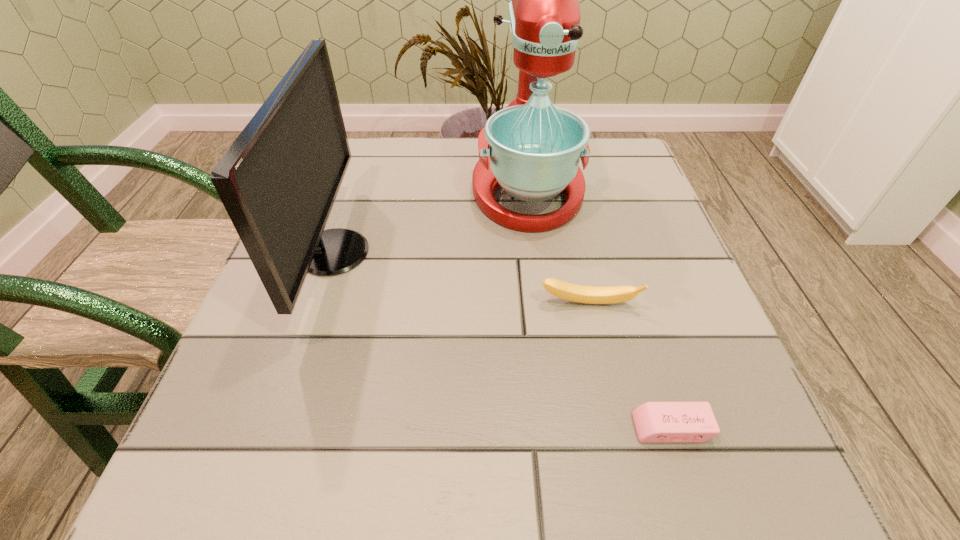
The image size is (960, 540). What are the coordinates of `vacant area at the near edge of the desktop` in the screenshot? It's located at (415, 472).

Where is `free space at the left edge of the desktop`? The width and height of the screenshot is (960, 540). free space at the left edge of the desktop is located at coordinates (374, 194).

The image size is (960, 540). What are the coordinates of `blank space at the right edge of the desktop` in the screenshot? It's located at (600, 271).

What are the coordinates of `free space at the far left corner of the desktop` in the screenshot? It's located at 371,145.

In the image, there is a desktop. Where is `free space at the far right corner`? free space at the far right corner is located at coordinates (603, 162).

I want to click on vacant space that's between the banana and the mixer, so click(x=558, y=246).

Where is `free space between the computer monitor and the banana`? The width and height of the screenshot is (960, 540). free space between the computer monitor and the banana is located at coordinates (461, 278).

Where is `free spot between the nearest object and the mixer`? The height and width of the screenshot is (540, 960). free spot between the nearest object and the mixer is located at coordinates (599, 308).

Find the location of a particular element. empty space between the nearest object and the second tallest object is located at coordinates (502, 340).

Where is `free space that is in between the eraser and the third tallest object`? free space that is in between the eraser and the third tallest object is located at coordinates (630, 366).